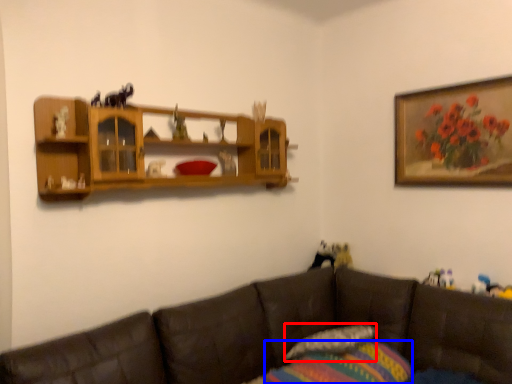
Question: Which of the following is the farthest to the observer, pillow (highlighted by a red box) or pillow (highlighted by a blue box)?

Choices:
 (A) pillow
 (B) pillow

Answer: (A)